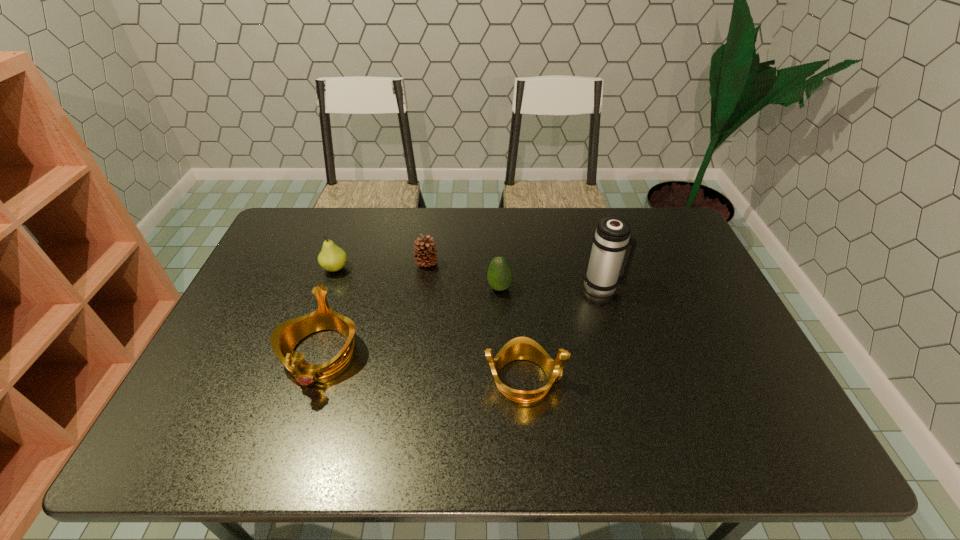
The height and width of the screenshot is (540, 960). Find the location of `the taller tiara`. the taller tiara is located at coordinates (284, 338).

I want to click on the right tiara, so tap(525, 348).

You are a GUI agent. You are given a task and a screenshot of the screen. Output one action in this format:
    pyautogui.click(x=<x>, y=<y>)
    Task: Click on the fourth object from right to left
    
    Given the screenshot: What is the action you would take?
    425,251

Locate an element on the screen. Image resolution: width=960 pixels, height=540 pixels. pear is located at coordinates (332, 258).

At what (x,y) coordinates should I click in order to perform the action: click on thermos bottle. Please return your answer as a coordinate pair (x, y). This screenshot has width=960, height=540. Looking at the image, I should click on (611, 238).

Locate an element on the screen. the tallest object is located at coordinates (611, 238).

You are a GUI agent. You are given a task and a screenshot of the screen. Output one action in this format:
    pyautogui.click(x=<x>, y=<y>)
    Task: Click on the avocado
    The height and width of the screenshot is (540, 960).
    Given the screenshot: What is the action you would take?
    pyautogui.click(x=499, y=275)

Image resolution: width=960 pixels, height=540 pixels. What are the coordinates of `vacant space located at the front emblem of the shorter tiara` in the screenshot? It's located at (723, 379).

Identify the location of vacant space located 0.390m on the front of the fourth object from right to left. This screenshot has height=540, width=960. (412, 376).

Identify the location of vacant space located on the back of the pear. The image size is (960, 540). (348, 231).